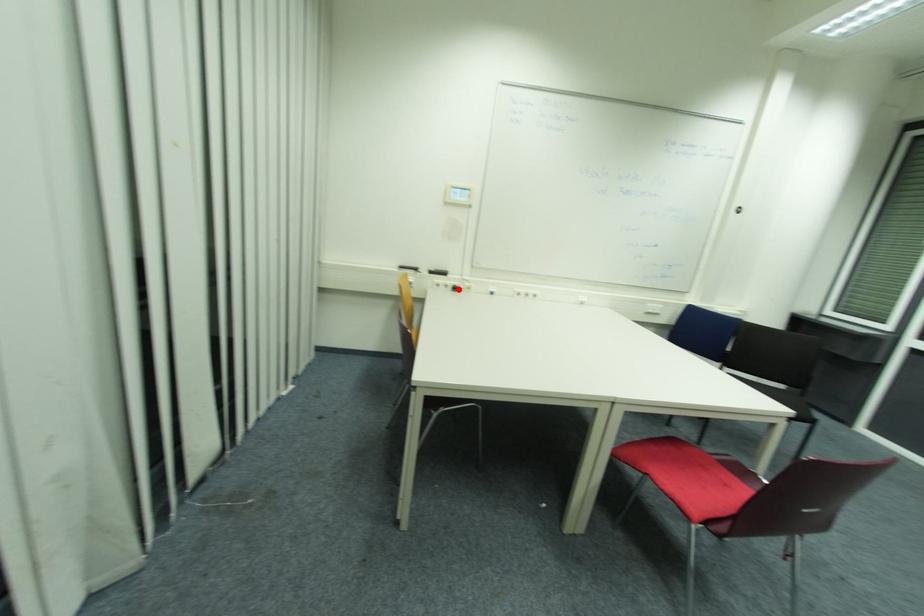
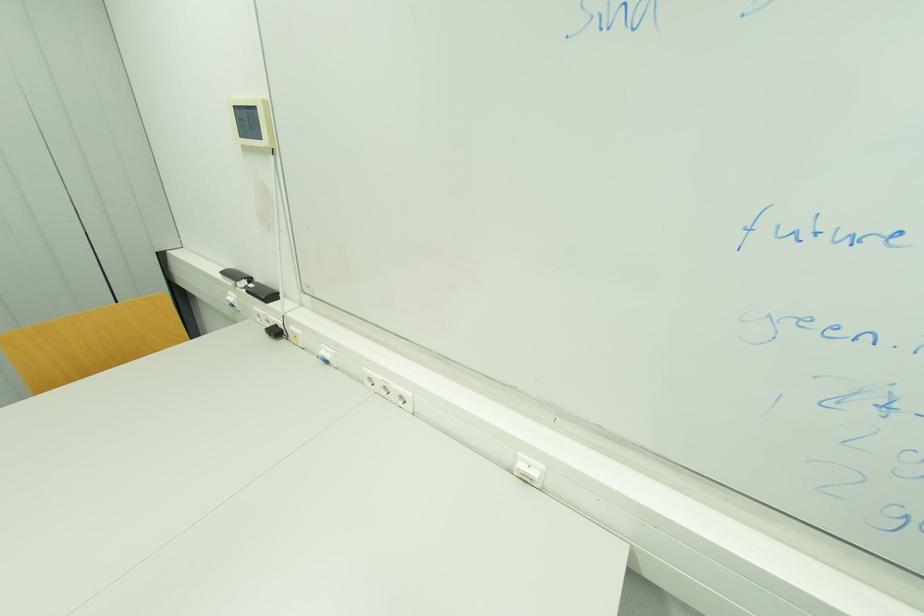
Locate, in the second image, the point that corresponds to the highlighted location in the first image.

(281, 333)